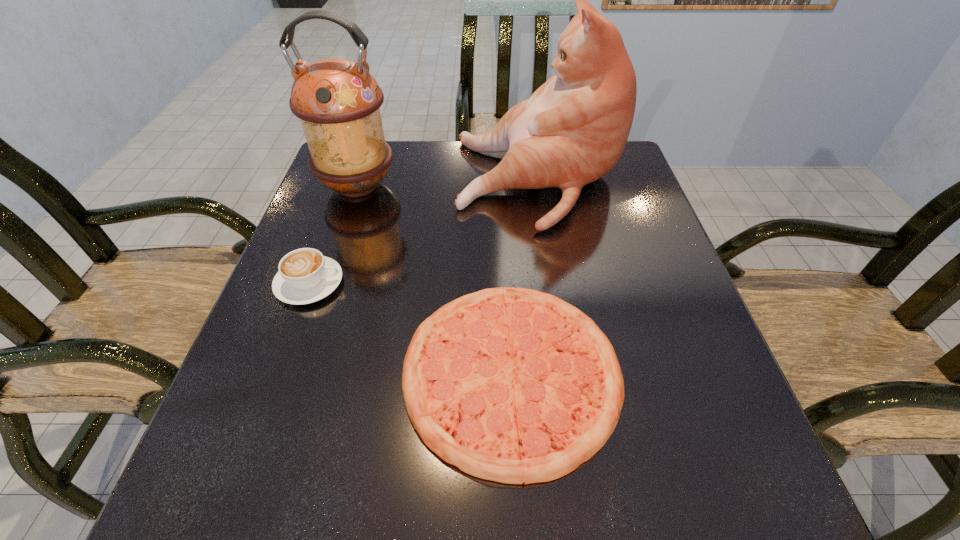
Find the location of a particular element. free space between the pizza and the third tallest object is located at coordinates (411, 328).

Identify the location of free area in between the shortest object and the oil lamp. Image resolution: width=960 pixels, height=540 pixels. (435, 279).

Choose which object is the third nearest neighbor to the cappuccino. Please provide its 2D coordinates. Your answer should be formatted as a tuple, i.e. [(x, y)], where the tuple contains the x and y coordinates of a point satisfying the conditions above.

[(572, 131)]

Locate which object is the closest to the cat. Please provide its 2D coordinates. Your answer should be formatted as a tuple, i.e. [(x, y)], where the tuple contains the x and y coordinates of a point satisfying the conditions above.

[(338, 101)]

You are a GUI agent. You are given a task and a screenshot of the screen. Output one action in this format:
    pyautogui.click(x=<x>, y=<y>)
    Task: Click on the free location that satisfies the following two spatial constraints: 1. on the side of the cappuccino with the handle; 2. on the back side of the pizza
    This screenshot has height=540, width=960.
    Given the screenshot: What is the action you would take?
    pyautogui.click(x=276, y=372)

Find the location of `free location that satisfies the following two spatial constraints: 1. on the front side of the oil lamp; 2. on the side of the cappuccino with the handle`. free location that satisfies the following two spatial constraints: 1. on the front side of the oil lamp; 2. on the side of the cappuccino with the handle is located at coordinates (325, 283).

Identify the location of free space in the image that satisfies the following two spatial constraints: 1. on the back side of the shortest object; 2. on the side of the third tallest object with the handle. Image resolution: width=960 pixels, height=540 pixels. (507, 283).

Where is `free spot that satisfies the following two spatial constraints: 1. on the side of the pizza with the handle; 2. on the left side of the third tallest object`? free spot that satisfies the following two spatial constraints: 1. on the side of the pizza with the handle; 2. on the left side of the third tallest object is located at coordinates (276, 372).

Locate an element on the screen. This screenshot has width=960, height=540. free space that satisfies the following two spatial constraints: 1. on the side of the cappuccino with the handle; 2. on the right side of the shortest object is located at coordinates (276, 372).

Find the location of `vacant space that satisfies the following two spatial constraints: 1. on the face of the cat; 2. on the front side of the oil lamp`. vacant space that satisfies the following two spatial constraints: 1. on the face of the cat; 2. on the front side of the oil lamp is located at coordinates (540, 186).